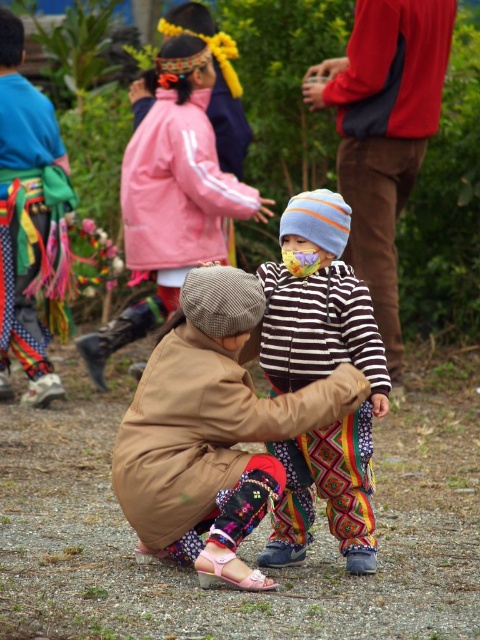
You are a photographer at this event and want to ensure both the brown fabric jacket at center and the matte pink jacket at center are clearly visible in your photo. Given their current positions, which jacket is closer to the camera?

The brown fabric jacket at center is positioned under the matte pink jacket at center, so the matte pink jacket at center is closer to the camera.

You are organizing a costume party and need to decide which item to place in a display case. The display case can only fit items smaller than the other. Which item should you choose between the striped hoodie at center and the brushed metal belt at left?

The brushed metal belt at left should be chosen because it is smaller than the striped hoodie at center, making it suitable for the display case that requires items smaller than the other.